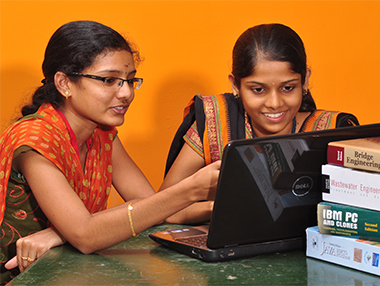
Image resolution: width=380 pixels, height=286 pixels. Find the location of `computer keyboard`. computer keyboard is located at coordinates (196, 239).